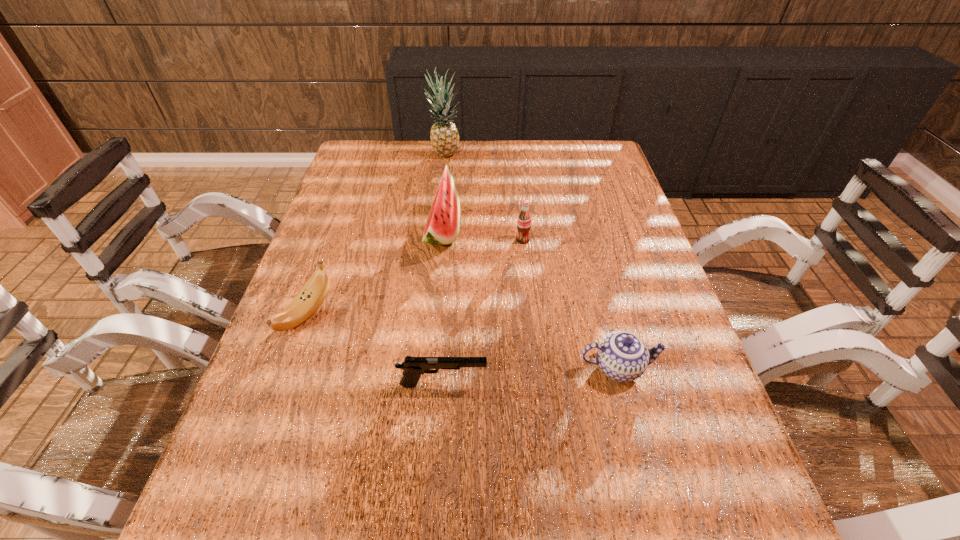
You are a GUI agent. You are given a task and a screenshot of the screen. Output one action in this format:
    pyautogui.click(x=<x>, y=<y>)
    Task: Click on the free space at the near left corner
    The height and width of the screenshot is (540, 960).
    Given the screenshot: What is the action you would take?
    pyautogui.click(x=297, y=516)

The width and height of the screenshot is (960, 540). Identify the location of vacant space at the far right corner of the desktop. (604, 167).

I want to click on vacant space at the near right corner, so click(x=677, y=531).

Where is `free space between the rightmost object and the pineapple`? This screenshot has width=960, height=540. free space between the rightmost object and the pineapple is located at coordinates (x=532, y=261).

At what (x,y) coordinates should I click in order to perform the action: click on empty space between the second object from right to left and the banana. Please return your answer as a coordinate pair (x, y). Image resolution: width=960 pixels, height=540 pixels. Looking at the image, I should click on (415, 277).

In order to click on free space that is in between the pineapple and the gun in this screenshot , I will do `click(444, 269)`.

Locate an element on the screen. vacant area that lies between the fifth object from left to right and the leftmost object is located at coordinates (415, 277).

Where is `vacant area between the watermelon and the second object from right to left`? vacant area between the watermelon and the second object from right to left is located at coordinates (483, 237).

At what (x,y) coordinates should I click in order to perform the action: click on unoccupied position between the banana and the rightmost object. Please return your answer as a coordinate pair (x, y). Looking at the image, I should click on (462, 341).

This screenshot has height=540, width=960. I want to click on free space between the rightmost object and the gun, so click(x=531, y=376).